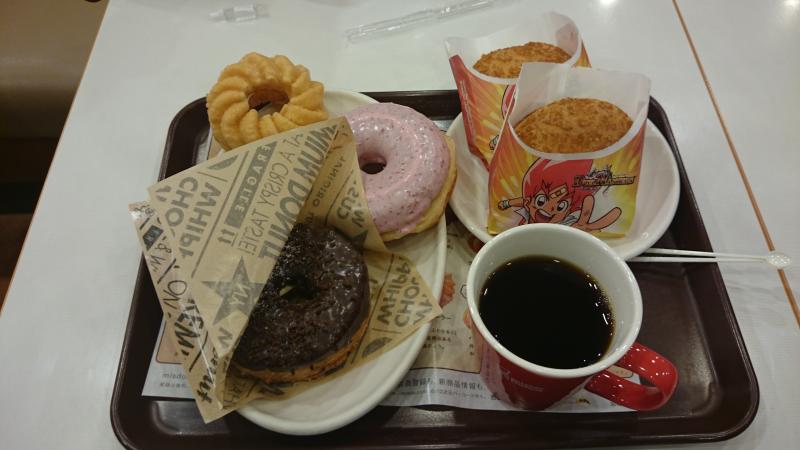
Locate an element on the screen. Image resolution: width=800 pixels, height=450 pixels. ceramic mug is located at coordinates (578, 244).